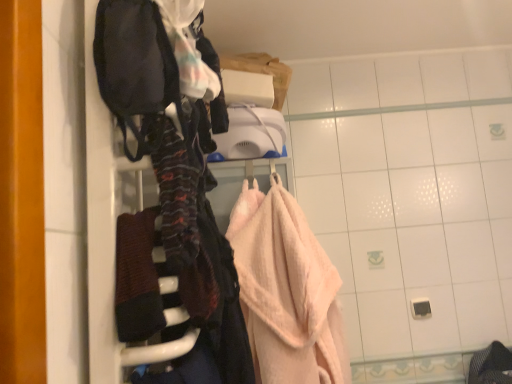
Question: From a real-world perspective, is dark brown textured towel at center over pink terry cloth towel at center?

Choices:
 (A) no
 (B) yes

Answer: (B)

Question: Is dark brown textured towel at center located outside pink terry cloth towel at center?

Choices:
 (A) yes
 (B) no

Answer: (A)

Question: Does dark brown textured towel at center have a larger size compared to pink terry cloth towel at center?

Choices:
 (A) no
 (B) yes

Answer: (A)

Question: Could you tell me if dark brown textured towel at center is facing pink terry cloth towel at center?

Choices:
 (A) yes
 (B) no

Answer: (B)

Question: Does dark brown textured towel at center have a smaller size compared to pink terry cloth towel at center?

Choices:
 (A) no
 (B) yes

Answer: (B)

Question: Would you say pink terry cloth towel at center is part of dark brown textured towel at center's contents?

Choices:
 (A) yes
 (B) no

Answer: (B)

Question: Is pink terry cloth towel at center positioned with its back to velvet dark bag at left?

Choices:
 (A) no
 (B) yes

Answer: (A)

Question: Is pink terry cloth towel at center shorter than velvet dark bag at left?

Choices:
 (A) yes
 (B) no

Answer: (A)

Question: Does pink terry cloth towel at center contain velvet dark bag at left?

Choices:
 (A) yes
 (B) no

Answer: (B)

Question: From a real-world perspective, is pink terry cloth towel at center below velvet dark bag at left?

Choices:
 (A) yes
 (B) no

Answer: (A)

Question: From a real-world perspective, is pink terry cloth towel at center physically above velvet dark bag at left?

Choices:
 (A) no
 (B) yes

Answer: (A)

Question: Is pink terry cloth towel at center smaller than velvet dark bag at left?

Choices:
 (A) no
 (B) yes

Answer: (A)

Question: Would you say dark brown textured towel at center is a long distance from velvet dark bag at left?

Choices:
 (A) yes
 (B) no

Answer: (B)